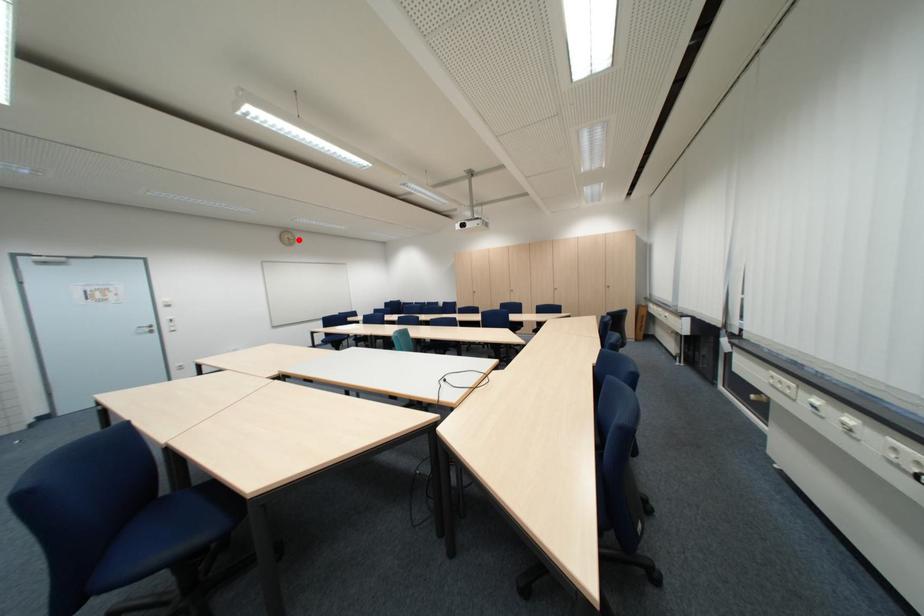
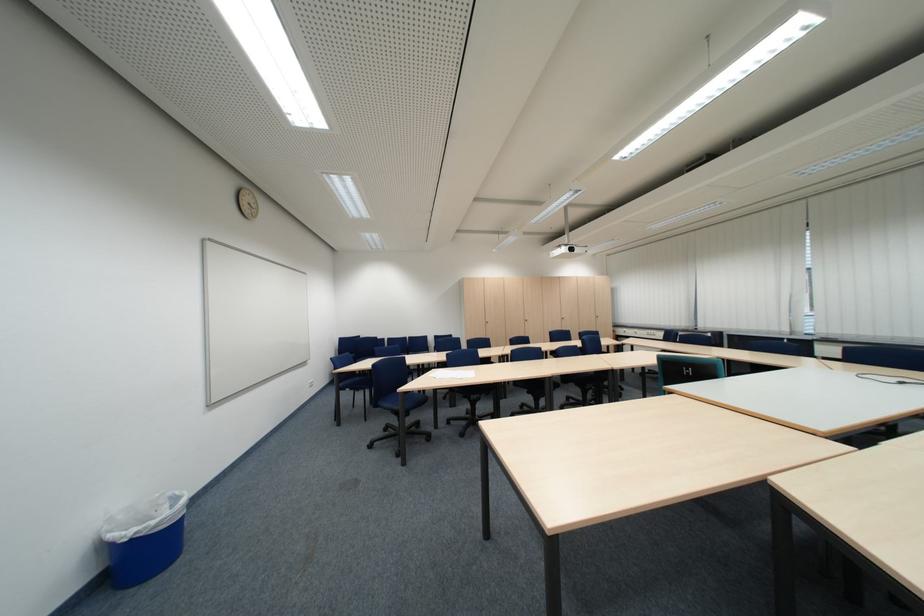
Where in the second image is the point corresponding to the highlighted location from the first image?

(257, 204)